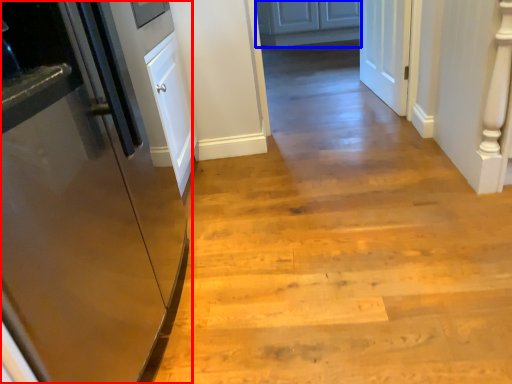
Question: Which object appears closest to the camera in this image, door (highlighted by a red box) or cabinetry (highlighted by a blue box)?

Choices:
 (A) door
 (B) cabinetry

Answer: (A)